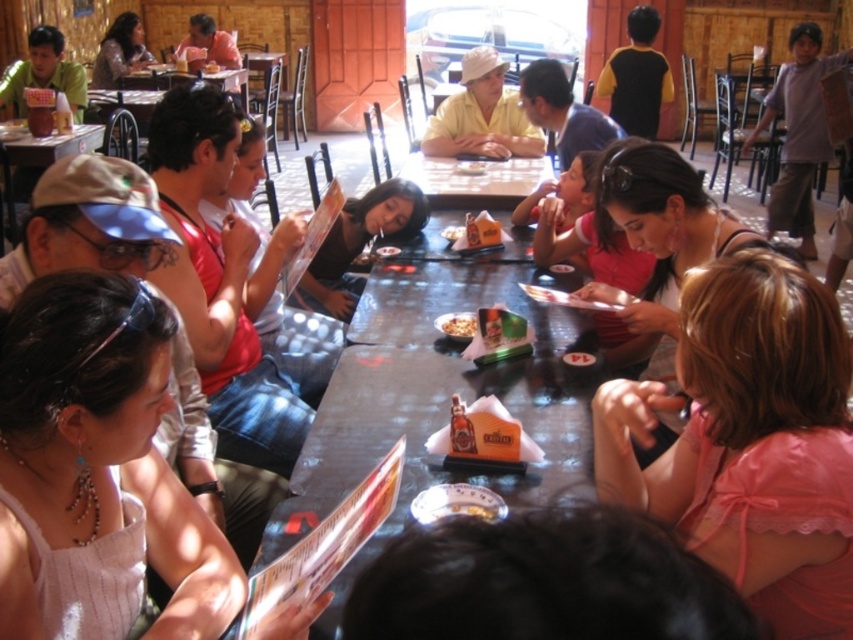
You are standing at the entrance of the restaurant and notice a white fabric tank top at lower left. Where exactly is it positioned in relation to the entrance?

The white fabric tank top at lower left is located at point 0.680 on the x axis and 0.123 on the y axis relative to the entrance.

You are standing at the entrance of the restaurant and want to locate the person wearing the matte pink shirt at center. According to the coordinates provided, in which direction should you look relative to the entrance?

The matte pink shirt at center is located at coordinates point (660, 236). Since the entrance is at the entrance, you should look towards the center of the image to find the matte pink shirt at center.